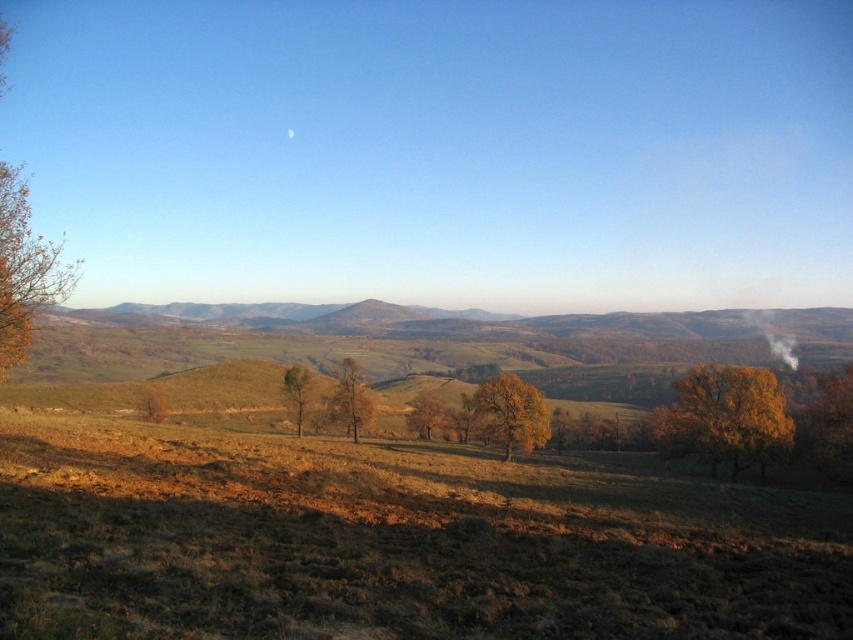
Which of these two, brown grassland at center or green leafy tree at center, stands shorter?

green leafy tree at center is shorter.

Which is more to the left, brown grassland at center or green leafy tree at center?

green leafy tree at center is more to the left.

Who is more forward, (741,541) or (300,406)?

Point (741,541) is in front.

Where is `brown grassland at center`? The width and height of the screenshot is (853, 640). brown grassland at center is located at coordinates (383, 534).

Who is higher up, yellow leafy tree at right or yellow matte tree at center?

Positioned higher is yellow leafy tree at right.

What do you see at coordinates (724, 417) in the screenshot? Image resolution: width=853 pixels, height=640 pixels. I see `yellow leafy tree at right` at bounding box center [724, 417].

Where is `yellow leafy tree at right`? This screenshot has width=853, height=640. yellow leafy tree at right is located at coordinates (724, 417).

Is brown grassland at center to the left of brown matte tree at center from the viewer's perspective?

In fact, brown grassland at center is to the right of brown matte tree at center.

Which is more to the left, brown grassland at center or brown matte tree at center?

brown matte tree at center

Who is more distant from viewer, (798, 548) or (347, 413)?

The point (347, 413) is more distant.

This screenshot has height=640, width=853. I want to click on brown grassland at center, so click(x=383, y=534).